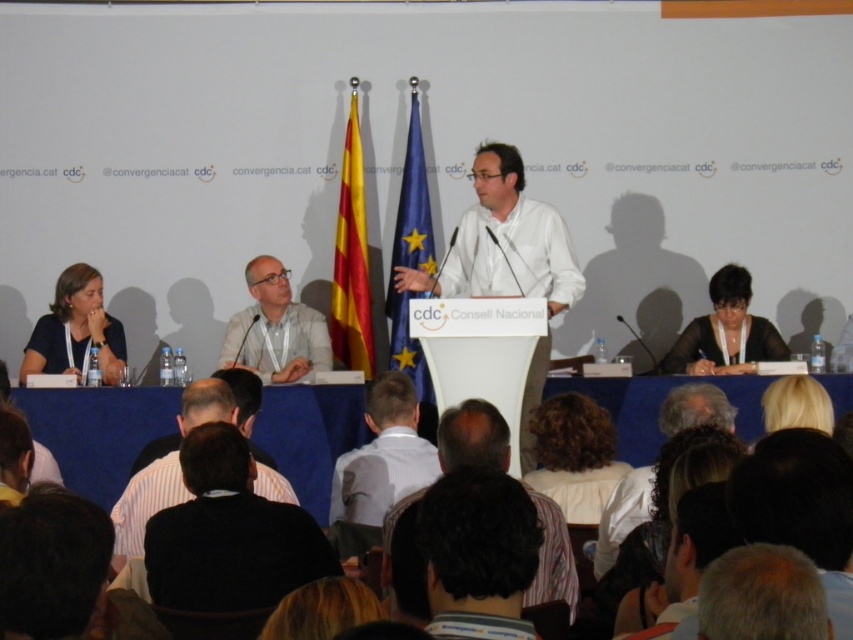
Does brown striped shirt at center have a smaller size compared to white shirt at center?

Actually, brown striped shirt at center might be larger than white shirt at center.

Is brown striped shirt at center wider than white shirt at center?

Yes.

Does point (488, 444) come farther from viewer compared to point (642, 490)?

That is False.

Locate an element on the screen. The height and width of the screenshot is (640, 853). brown striped shirt at center is located at coordinates (473, 436).

Can you confirm if black striped shirt at center is positioned above white shirt at center?

Incorrect, black striped shirt at center is not positioned above white shirt at center.

Which is below, black striped shirt at center or white shirt at center?

black striped shirt at center

In order to click on black striped shirt at center in this screenshot , I will do `click(144, 504)`.

In order to click on black striped shirt at center in this screenshot , I will do `click(144, 504)`.

Does white shirt at center come behind blonde hair at lower right?

No, it is in front of blonde hair at lower right.

The width and height of the screenshot is (853, 640). In order to click on white shirt at center in this screenshot , I will do `click(622, 515)`.